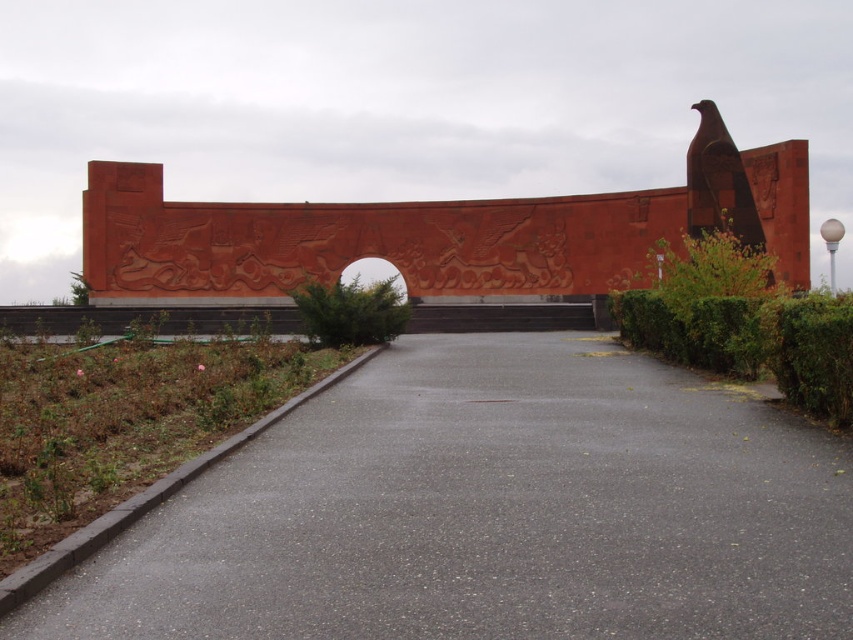
Question: Does green leafy hedge at right have a smaller size compared to green leafy hedge at center?

Choices:
 (A) no
 (B) yes

Answer: (A)

Question: Is gray asphalt pavement at center bigger than green leafy hedge at center?

Choices:
 (A) no
 (B) yes

Answer: (A)

Question: Is gray asphalt pavement at center to the right of green leafy hedge at right from the viewer's perspective?

Choices:
 (A) yes
 (B) no

Answer: (B)

Question: Which point is farther to the camera?

Choices:
 (A) (363, 310)
 (B) (589, 600)

Answer: (A)

Question: Among these objects, which one is farthest from the camera?

Choices:
 (A) gray asphalt pavement at center
 (B) green leafy hedge at right
 (C) green leafy hedge at center

Answer: (C)

Question: Which point is farther to the camera?

Choices:
 (A) green leafy hedge at right
 (B) green leafy hedge at center
 (C) gray asphalt pavement at center

Answer: (B)